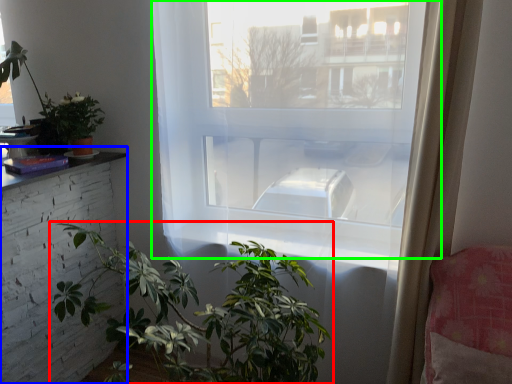
Question: Which is farther away from houseplant (highlighted by a red box)? table (highlighted by a blue box) or window (highlighted by a green box)?

Choices:
 (A) table
 (B) window

Answer: (A)